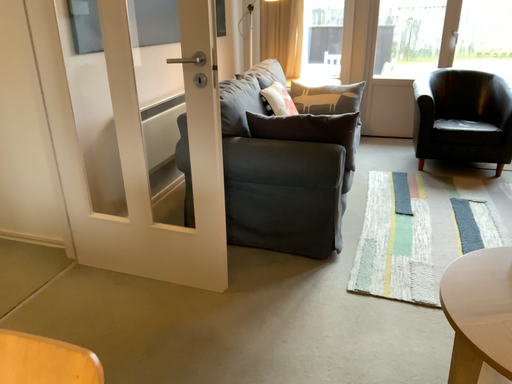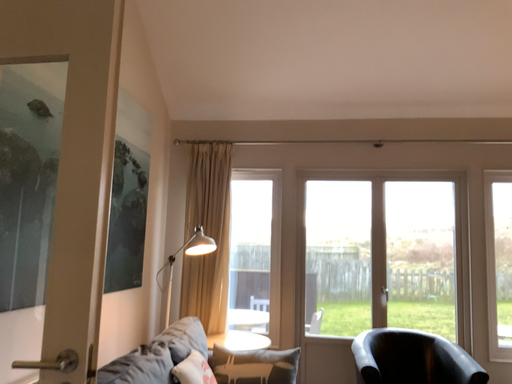
Question: Which way did the camera rotate in the video?

Choices:
 (A) rotated left
 (B) rotated right

Answer: (B)